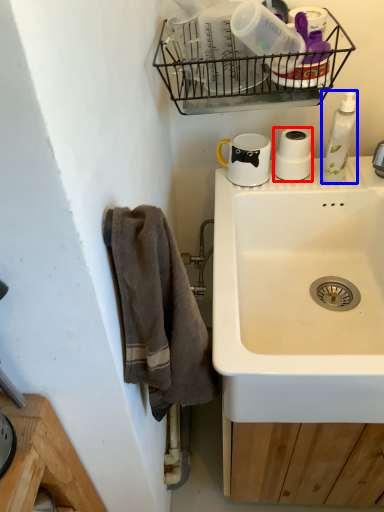
Question: Which object appears farthest to the camera in this image, appliance (highlighted by a red box) or cleaning product (highlighted by a blue box)?

Choices:
 (A) appliance
 (B) cleaning product

Answer: (A)